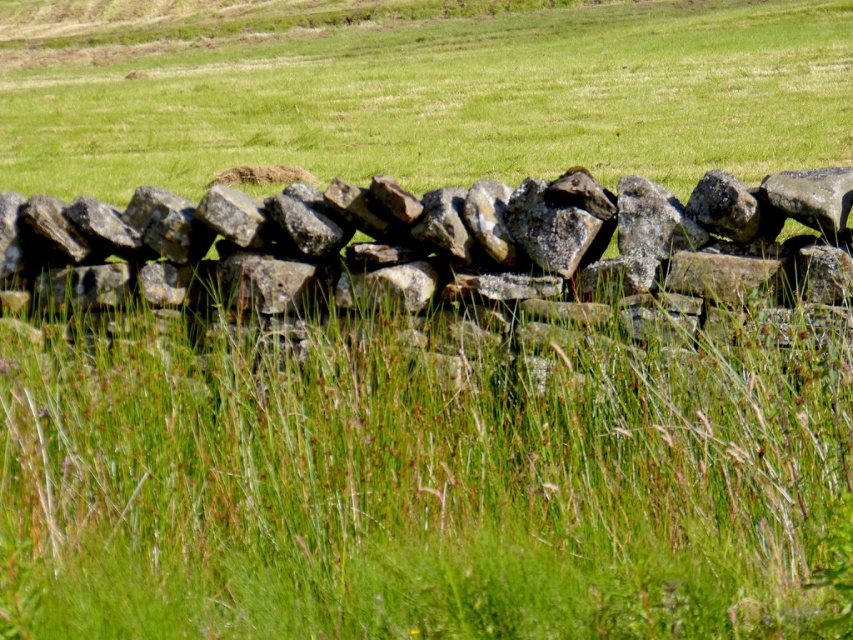
Question: Which point is farther from the camera taking this photo?

Choices:
 (A) (772, 212)
 (B) (521, 36)

Answer: (B)

Question: Which point is farther from the camera taking this photo?

Choices:
 (A) (210, 202)
 (B) (463, 74)

Answer: (B)

Question: Is green grass at center positioned in front of rough stone wall at center?

Choices:
 (A) yes
 (B) no

Answer: (B)

Question: Which point is farther from the camera taking this photo?

Choices:
 (A) (556, 186)
 (B) (213, 84)

Answer: (B)

Question: Does green grass at center appear on the left side of rough stone wall at center?

Choices:
 (A) no
 (B) yes

Answer: (A)

Question: Can you confirm if green grass at center is positioned to the left of rough stone wall at center?

Choices:
 (A) no
 (B) yes

Answer: (A)